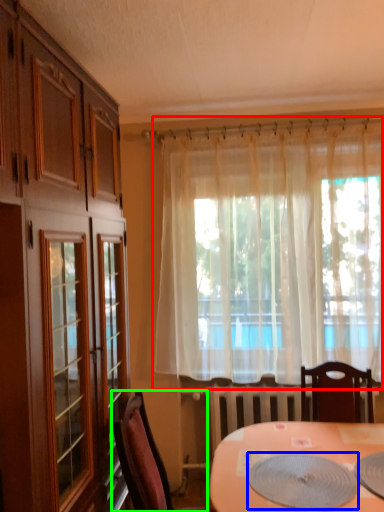
Question: Estimate the real-world distances between objects in this image. Which object is closer to curtain (highlighted by a red box), platter (highlighted by a blue box) or chair (highlighted by a green box)?

Choices:
 (A) platter
 (B) chair

Answer: (A)